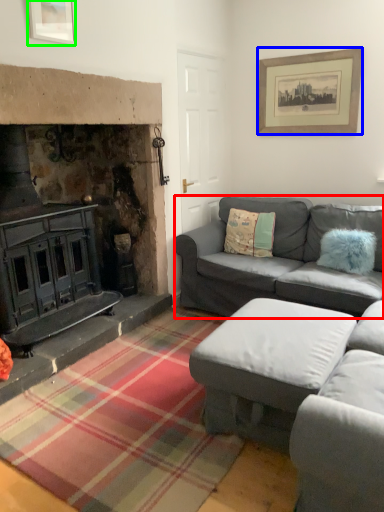
Question: Which is nearer to the studio couch (highlighted by a red box)? picture frame (highlighted by a blue box) or picture frame (highlighted by a green box).

Choices:
 (A) picture frame
 (B) picture frame

Answer: (A)